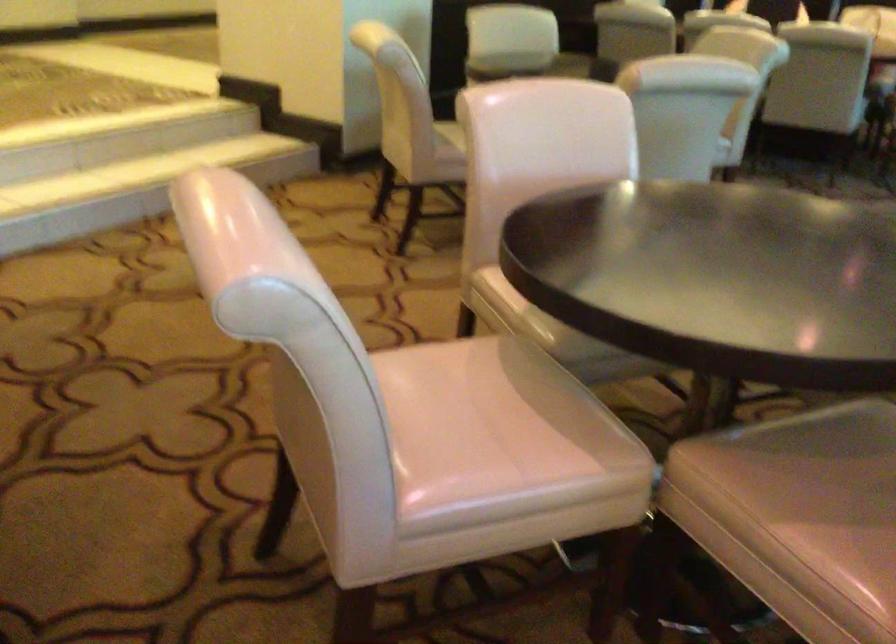
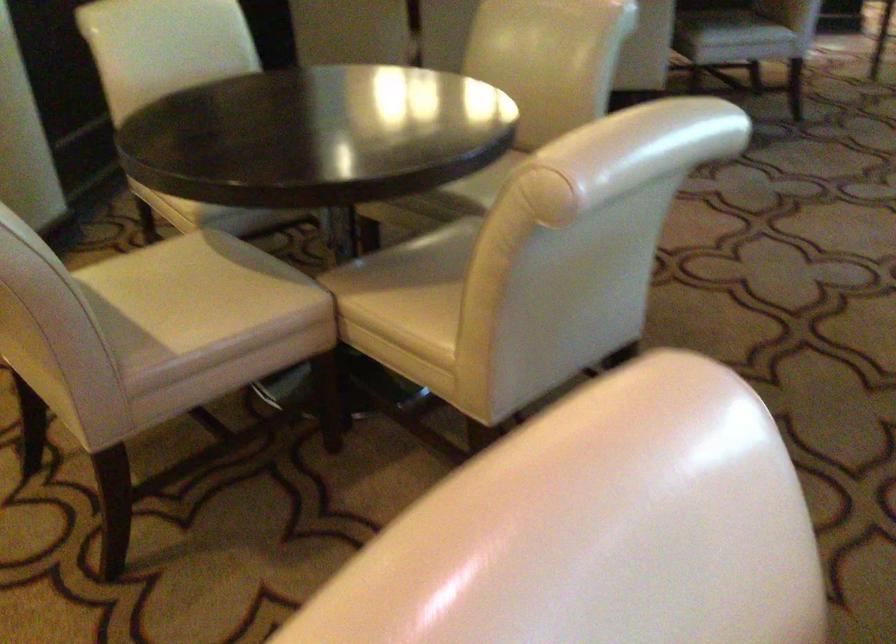
Question: The images are taken continuously from a first-person perspective. In which direction are you moving?

Choices:
 (A) Left
 (B) Right
 (C) Forward
 (D) Backward

Answer: (C)